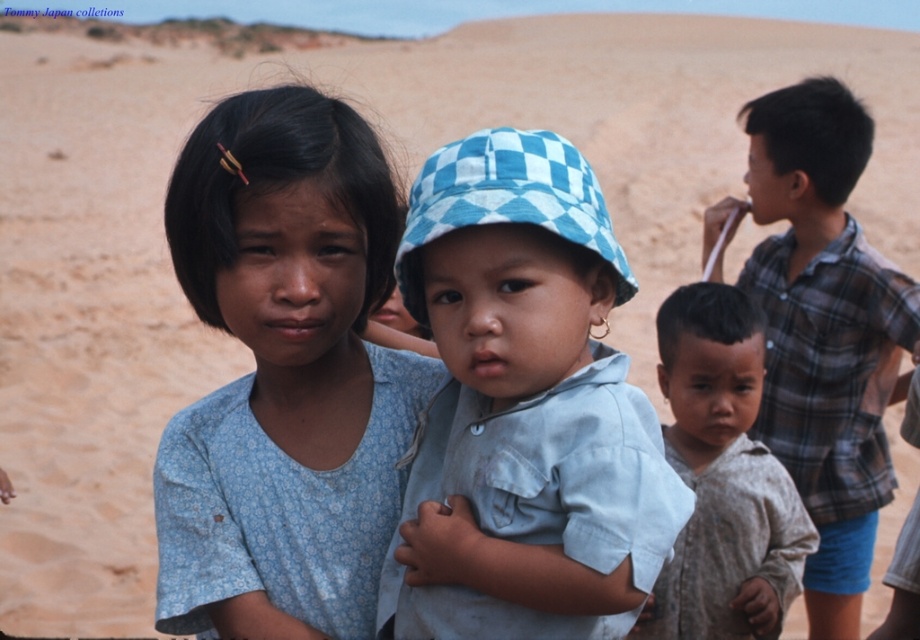
Question: Is plaid cotton shirt at right thinner than brown cotton shirt at lower right?

Choices:
 (A) no
 (B) yes

Answer: (A)

Question: Considering the real-world distances, which object is closest to the brown cotton shirt at lower right?

Choices:
 (A) blue floral shirt at center
 (B) light blue checkered hat at center

Answer: (A)

Question: Which point is closer to the camera?

Choices:
 (A) (535, 605)
 (B) (815, 172)
 (C) (719, 388)
 (D) (223, 618)

Answer: (A)

Question: Estimate the real-world distances between objects in this image. Which object is closer to the plaid cotton shirt at right?

Choices:
 (A) brown cotton shirt at lower right
 (B) blue floral shirt at center

Answer: (A)

Question: Does light blue checkered hat at center appear under plaid cotton shirt at right?

Choices:
 (A) yes
 (B) no

Answer: (A)

Question: Is blue floral shirt at center below brown cotton shirt at lower right?

Choices:
 (A) no
 (B) yes

Answer: (A)